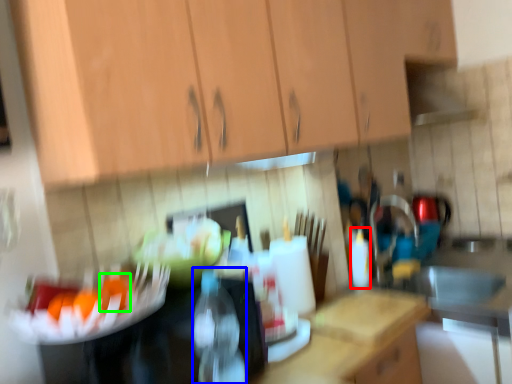
Question: Which is nearer to the bottle (highlighted by a red box)? bottle (highlighted by a blue box) or food (highlighted by a green box).

Choices:
 (A) bottle
 (B) food

Answer: (A)